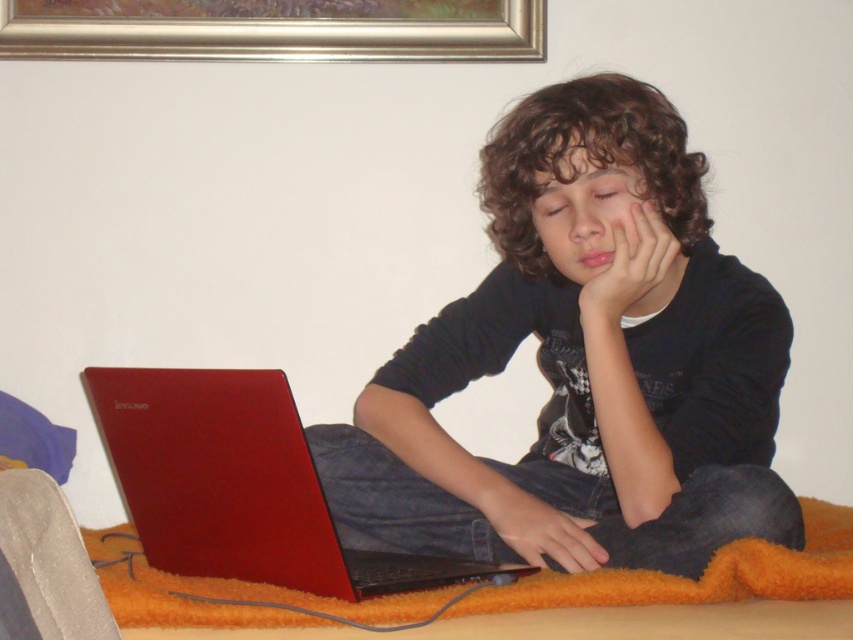
Question: Is matte red laptop at center in front of matte skin hand at center?

Choices:
 (A) yes
 (B) no

Answer: (A)

Question: Which point is farther to the camera?

Choices:
 (A) matte black shirt at center
 (B) matte black hand at lower center

Answer: (B)

Question: Is matte black shirt at center positioned before silver metallic picture frame at upper center?

Choices:
 (A) yes
 (B) no

Answer: (A)

Question: Can you confirm if matte red laptop at center is thinner than matte skin hand at center?

Choices:
 (A) yes
 (B) no

Answer: (B)

Question: Among these objects, which one is farthest from the camera?

Choices:
 (A) matte black hand at lower center
 (B) silver metallic picture frame at upper center

Answer: (B)

Question: Among these objects, which one is nearest to the camera?

Choices:
 (A) matte skin hand at center
 (B) matte red laptop at center

Answer: (B)